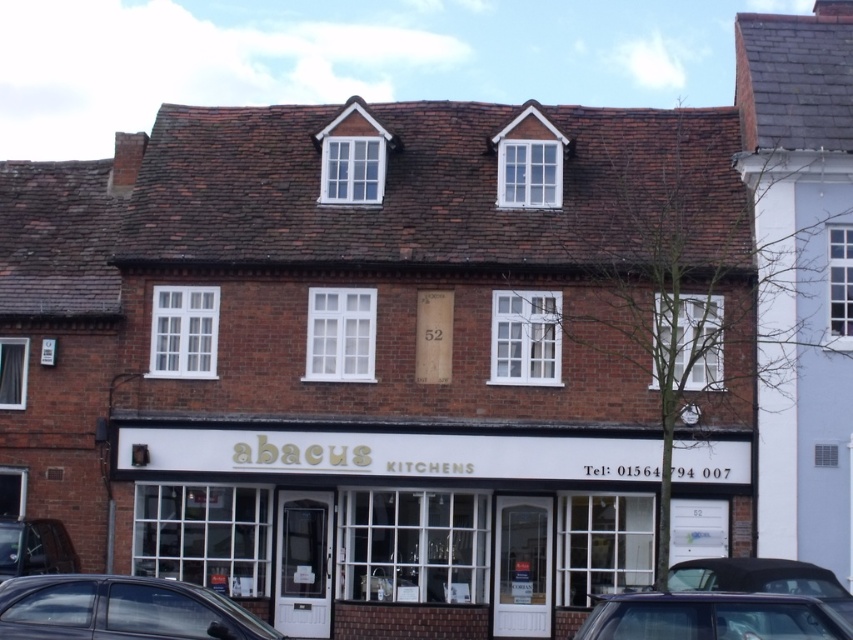
You are a customer arriving by car to visit the store. You see the white wooden storefront at center and the metallic gray car at lower center. Which object is closer to the entrance of the store?

The white wooden storefront at center is closer to the entrance of the store because it is positioned to the left of the metallic gray car at lower center, indicating it is nearer to the store entrance.